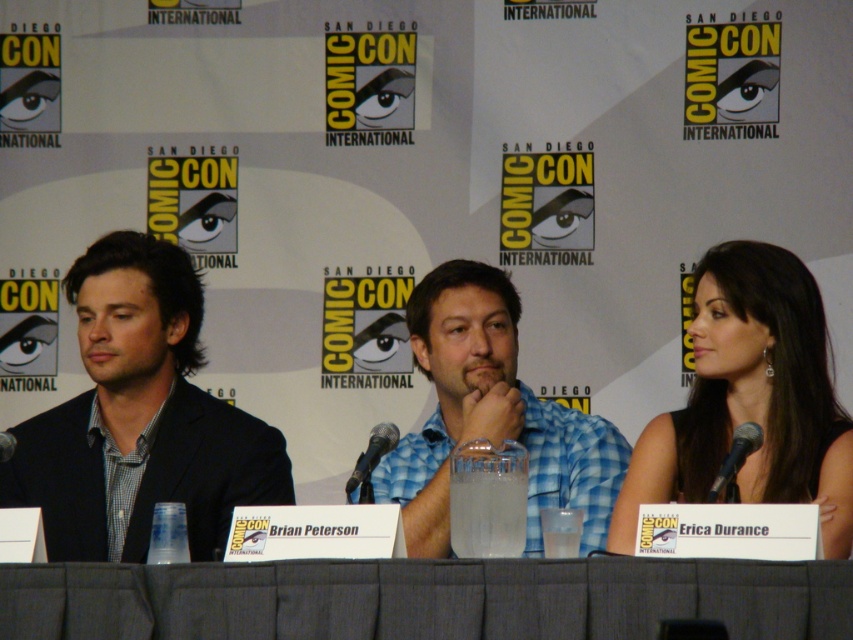
Question: Which point is farther to the camera?

Choices:
 (A) (4, 444)
 (B) (370, 451)

Answer: (A)

Question: Estimate the real-world distances between objects in this image. Which object is farther from the silver metallic microphone at right?

Choices:
 (A) black silk dress at right
 (B) black metallic microphone at center
 (C) gray fabric table at center
 (D) black plastic microphone at left

Answer: (D)

Question: Can you confirm if black metallic microphone at center is wider than black plastic microphone at left?

Choices:
 (A) no
 (B) yes

Answer: (B)

Question: Does gray fabric table at center have a smaller size compared to silver metallic microphone at right?

Choices:
 (A) no
 (B) yes

Answer: (A)

Question: Which object is positioned farthest from the silver metallic microphone at right?

Choices:
 (A) black silk dress at right
 (B) gray fabric table at center

Answer: (B)

Question: Does black silk dress at right have a lesser width compared to black metallic microphone at center?

Choices:
 (A) yes
 (B) no

Answer: (B)